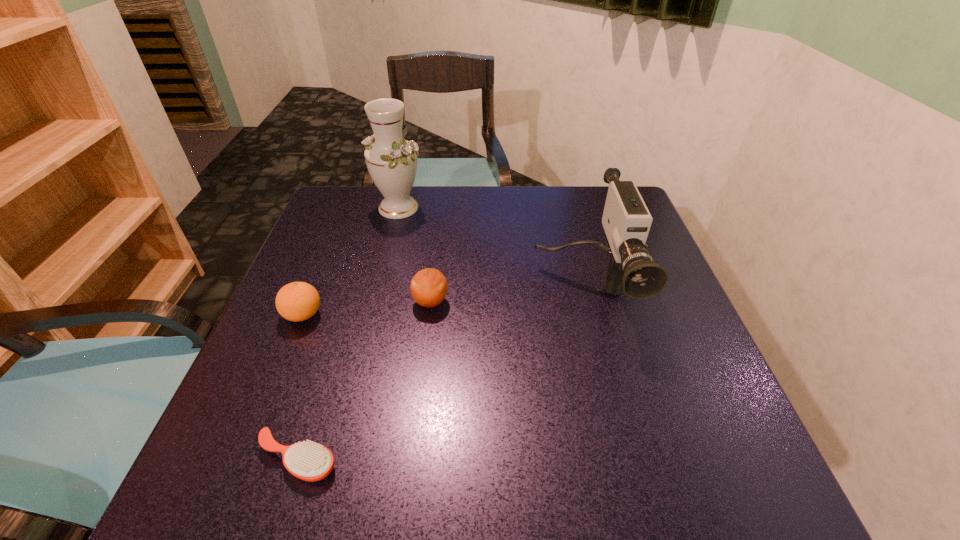
Image resolution: width=960 pixels, height=540 pixels. Identify the location of vase. (391, 160).

Locate an element on the screen. The height and width of the screenshot is (540, 960). the farthest object is located at coordinates (391, 160).

The width and height of the screenshot is (960, 540). I want to click on the fourth shortest object, so click(626, 220).

Image resolution: width=960 pixels, height=540 pixels. I want to click on camcorder, so click(626, 220).

Find the location of a particular element. the right orange is located at coordinates (428, 287).

Where is `the left orange`? The height and width of the screenshot is (540, 960). the left orange is located at coordinates (297, 301).

Locate an element on the screen. This screenshot has width=960, height=540. the shortest object is located at coordinates (309, 461).

Find the location of `hairbrush`. hairbrush is located at coordinates (309, 461).

Locate an element on the screen. This screenshot has width=960, height=540. free spot located on the right of the tallest object is located at coordinates (490, 208).

Locate an element on the screen. The height and width of the screenshot is (540, 960). vacant space located on the recording direction of the rightmost object is located at coordinates (634, 495).